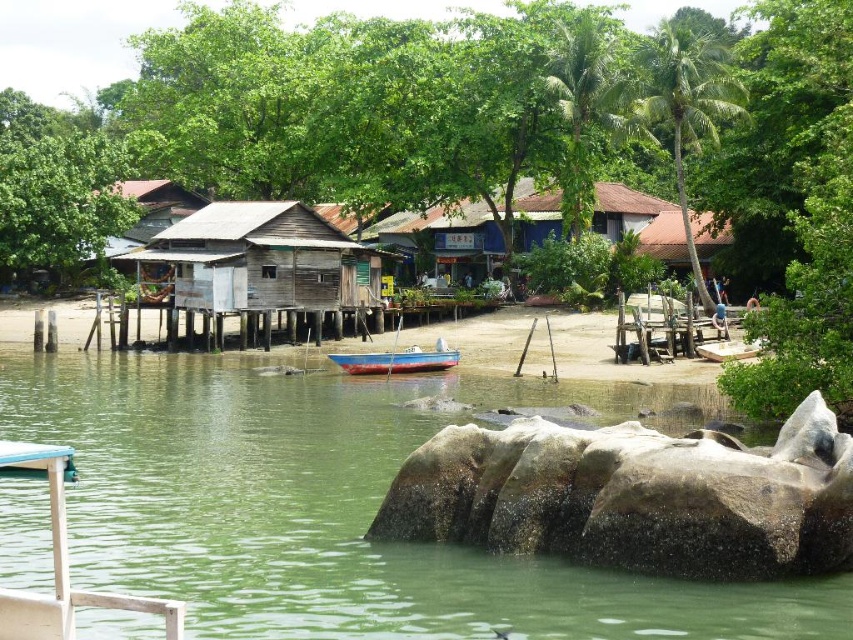
You are a photographer planning to capture a shot of the blue painted wood boat at center and the green smooth water at center. From your current position, which object is located to the right?

The blue painted wood boat at center is located to the right of the green smooth water at center.